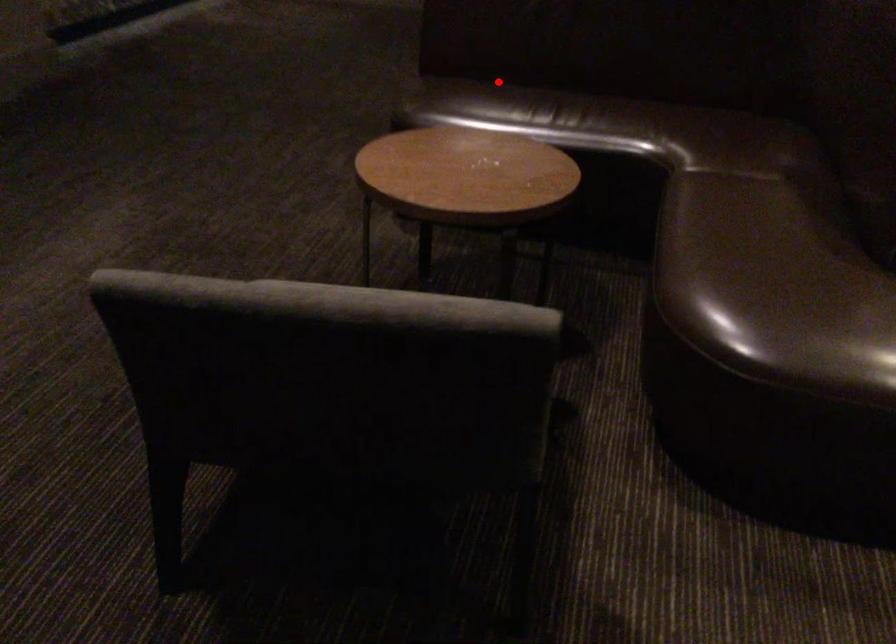
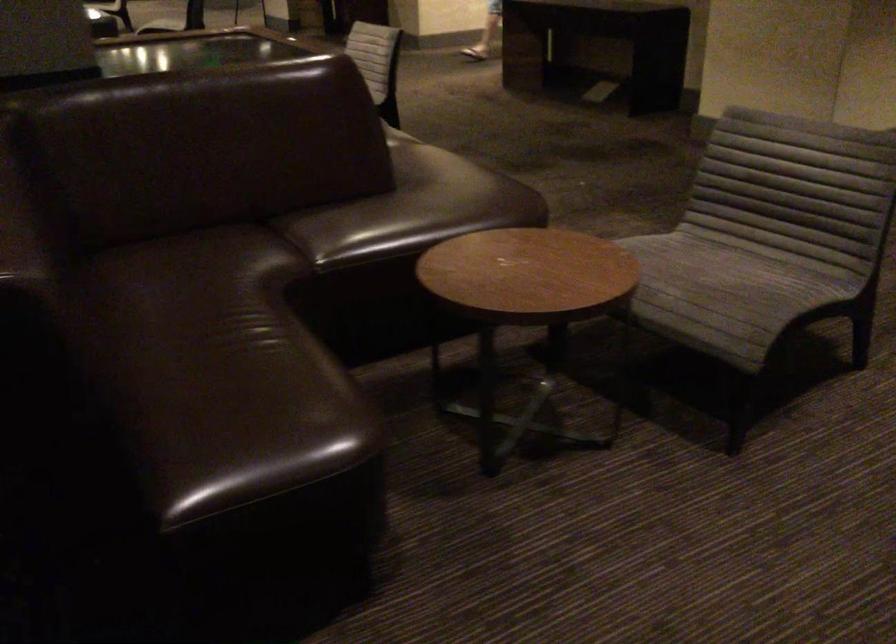
Locate, in the second image, the point that corresponds to the highlighted location in the first image.

(231, 399)